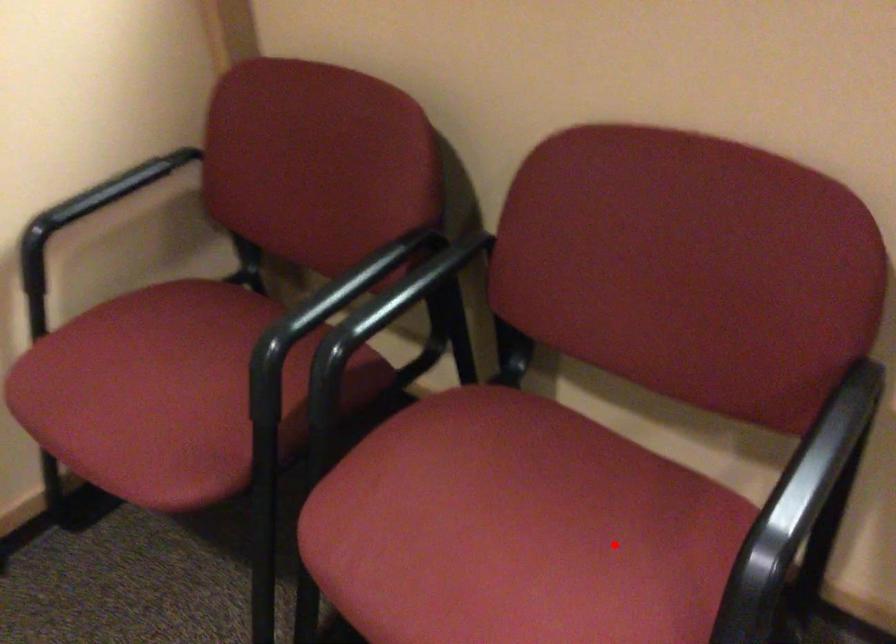
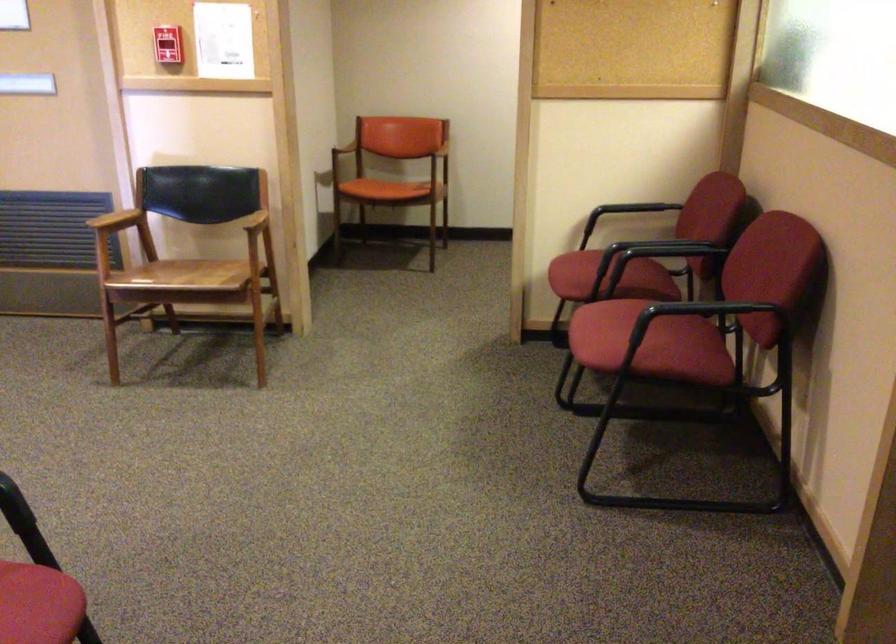
Question: I am providing you with two images of the same scene from different viewpoints. Image1 has a red point marked. In image2, the corresponding 3D location appears at what relative position? Reply with the corresponding letter.

Choices:
 (A) Closer
 (B) Farther

Answer: (B)